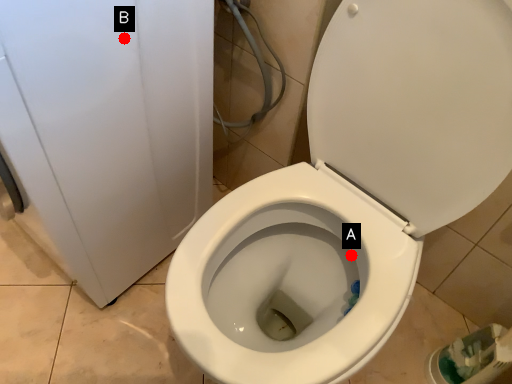
Question: Two points are circled on the image, labeled by A and B beside each circle. Which point is closer to the camera taking this photo?

Choices:
 (A) A is closer
 (B) B is closer

Answer: (B)